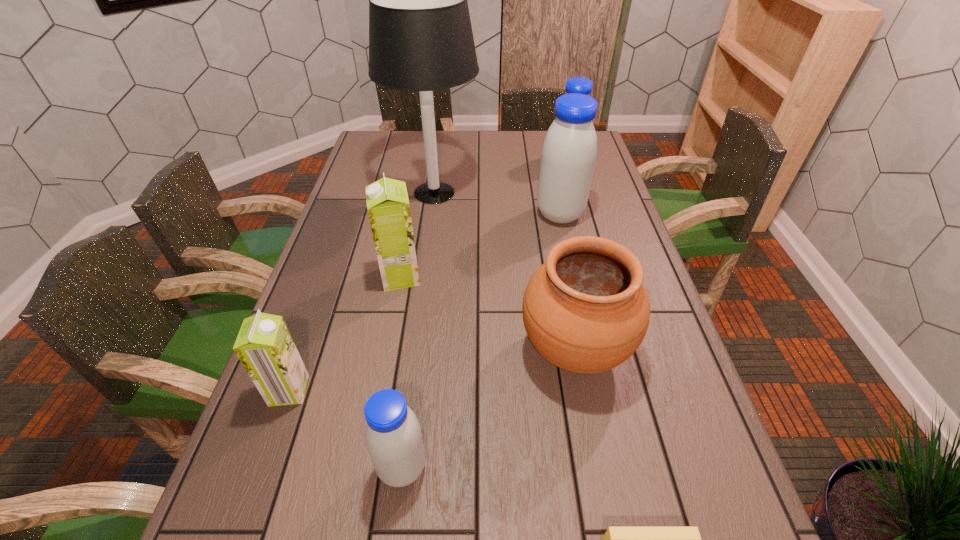
At what (x,y) coordinates should I click in order to perform the action: click on unoccupied position between the nearest soya milk and the second biggest blue soya milk. Please return your answer as a coordinate pair (x, y). This screenshot has width=960, height=540. Looking at the image, I should click on (485, 315).

Where is `vacant space that is in between the smallest blue soya milk and the right green soya milk`? vacant space that is in between the smallest blue soya milk and the right green soya milk is located at coordinates (401, 372).

Locate an element on the screen. vacant space that is in between the farther green soya milk and the pottery is located at coordinates (488, 313).

Find the location of `object that stands as the fourth closest to the pottery`. object that stands as the fourth closest to the pottery is located at coordinates (569, 151).

Point out which object is positioned as the fourth nearest to the third farthest soya milk. Please provide its 2D coordinates. Your answer should be formatted as a tuple, i.e. [(x, y)], where the tuple contains the x and y coordinates of a point satisfying the conditions above.

[(569, 151)]

This screenshot has width=960, height=540. I want to click on soya milk that is the fourth closest to the table lamp, so 264,346.

Identify the location of soya milk that can be found as the fifth closest to the videotape. (581, 85).

Select which blue soya milk appears as the third closest to the leftmost soya milk. Please provide its 2D coordinates. Your answer should be formatted as a tuple, i.e. [(x, y)], where the tuple contains the x and y coordinates of a point satisfying the conditions above.

[(581, 85)]

Point out which blue soya milk is positioned as the second nearest to the farthest blue soya milk. Please provide its 2D coordinates. Your answer should be formatted as a tuple, i.e. [(x, y)], where the tuple contains the x and y coordinates of a point satisfying the conditions above.

[(393, 437)]

You are a GUI agent. You are given a task and a screenshot of the screen. Output one action in this format:
    pyautogui.click(x=<x>, y=<y>)
    Task: Click on the free space that satisfies the following two spatial constraints: 1. on the back side of the pottery; 2. on the left side of the farthest blue soya milk
    
    Given the screenshot: What is the action you would take?
    pyautogui.click(x=540, y=162)